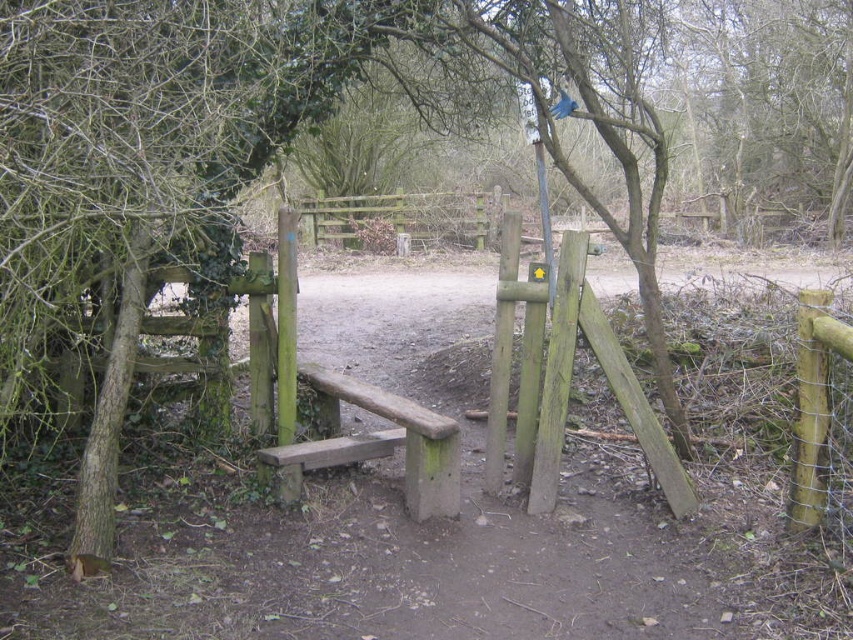
You are a hiker trying to reach the wooden gate at center. There is a green mossy wood bench at center in your path. Can you walk around it without going off the trail?

The green mossy wood bench at center is 41.54 feet away from wooden gate at center. Since the bench is directly in the center path, you can walk around it either to the left or right side of the trail to reach the wooden gate at center without deviating from the trail.

You are a hiker trying to cross the stile. You see a green mossy wood bench at center and a wooden gate at center. Which object is shorter?

The green mossy wood bench at center is shorter than the wooden gate at center.